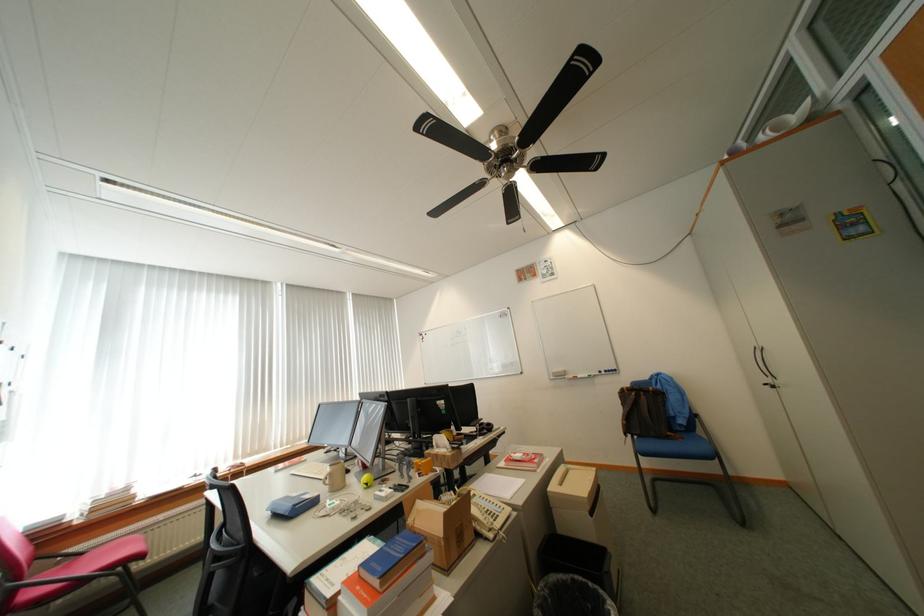
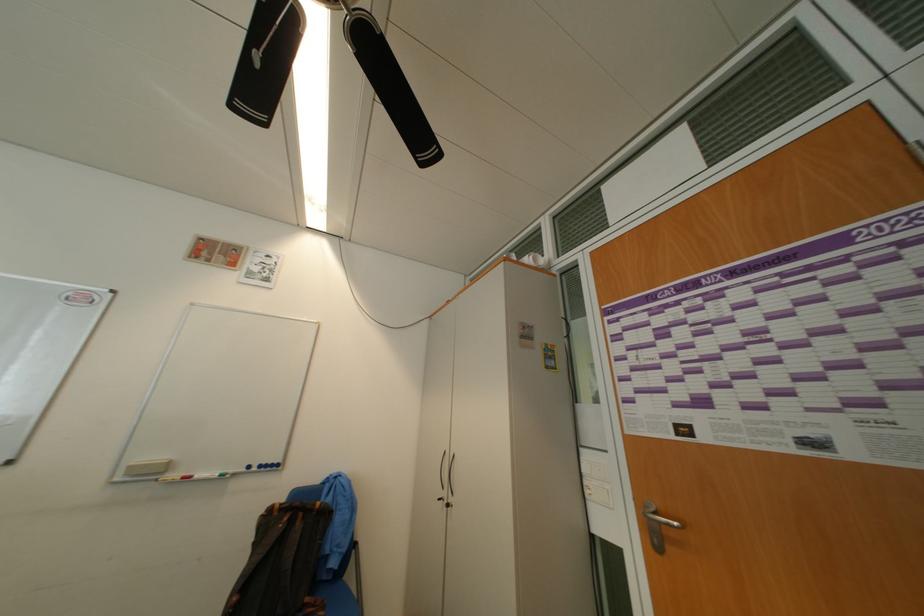
Find the pixel in the second image that matches the point at 569,377 in the first image.

(159, 475)